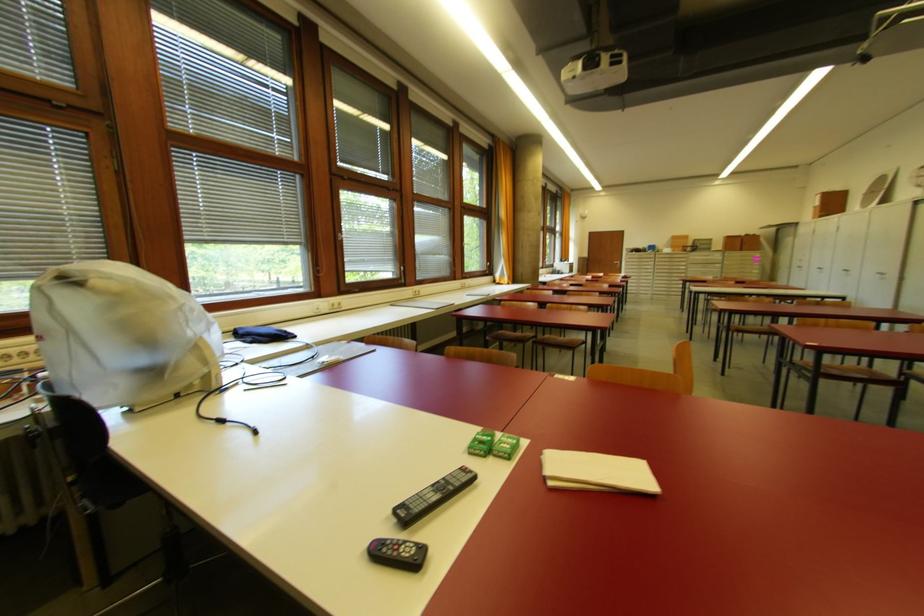
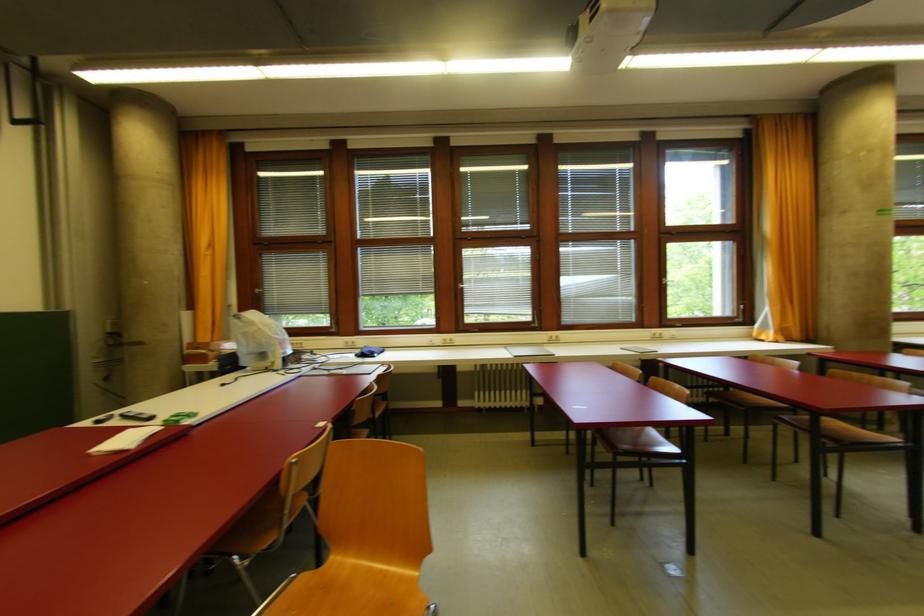
Where in the second image is the point corresponding to (x=467, y=286) from the first image?

(660, 338)